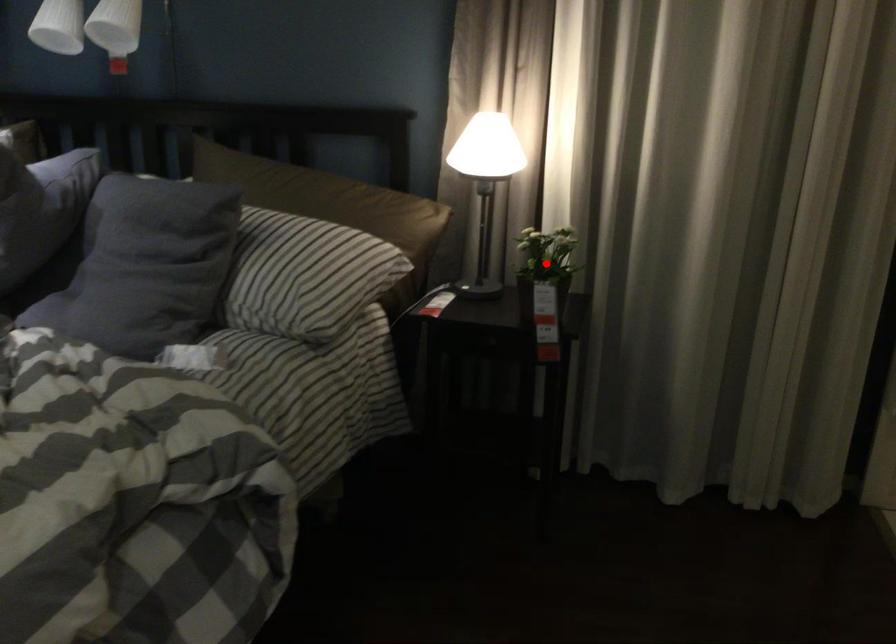
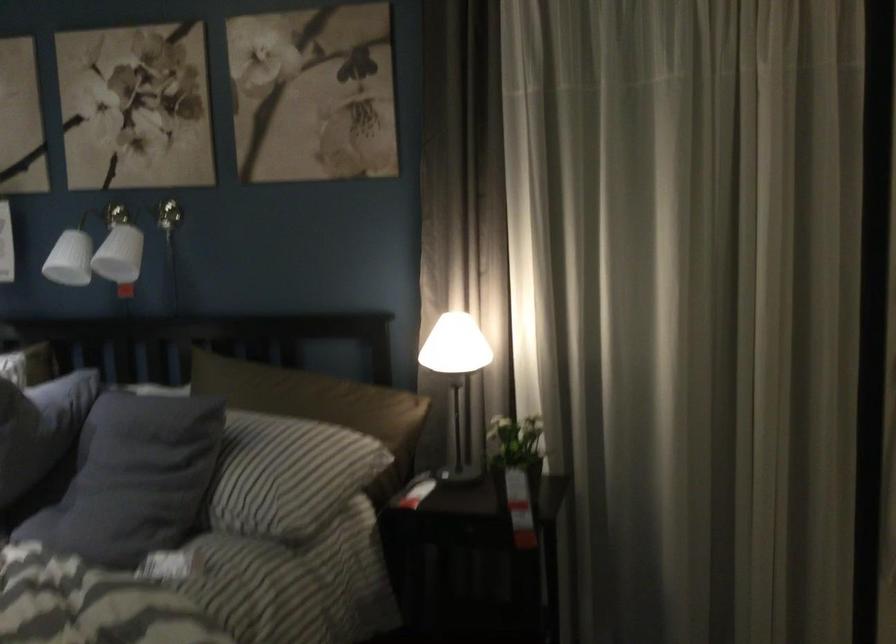
Find the pixel in the second image that matches the highlighted location in the first image.

(515, 451)